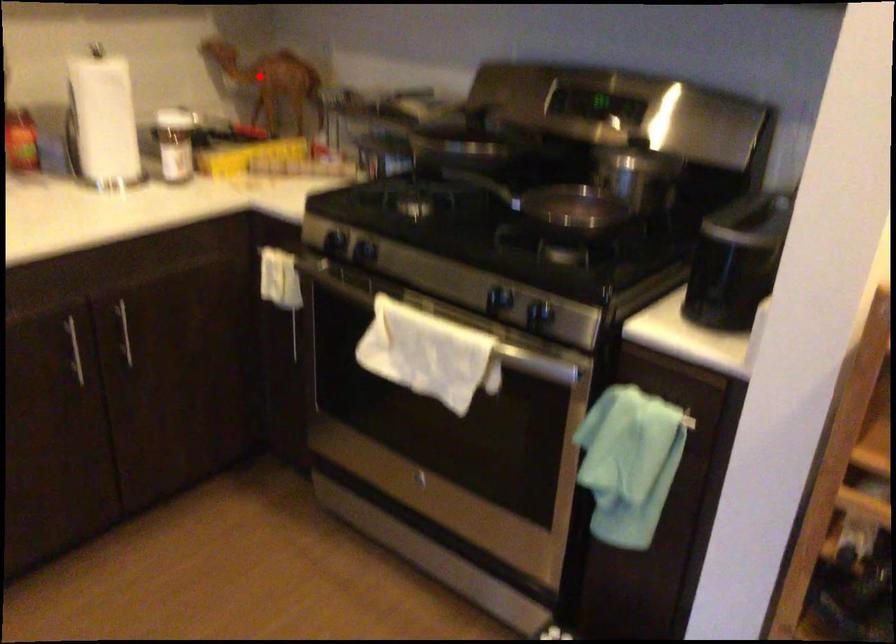
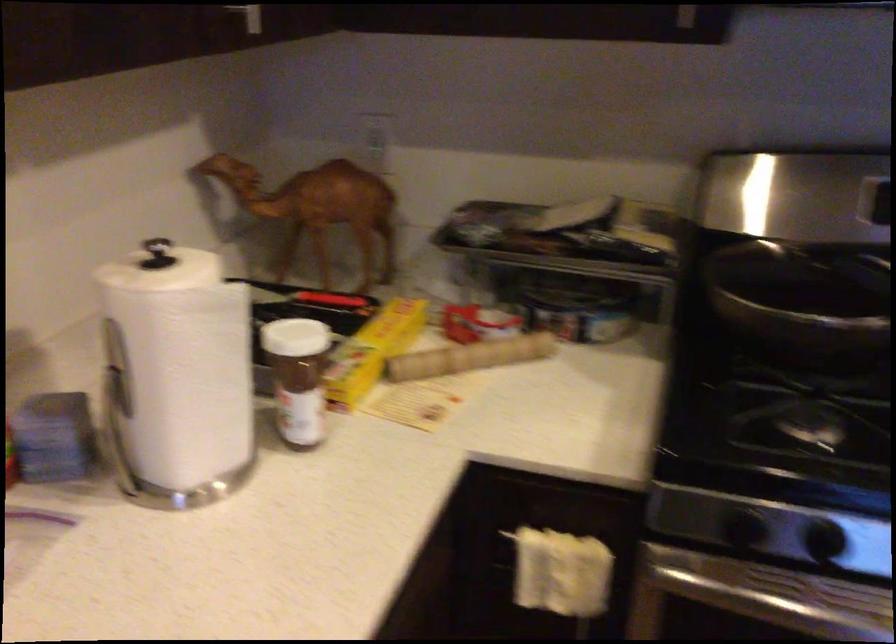
Question: I am providing you with two images of the same scene from different viewpoints. In image1, a red point is highlighted. Considering the same 3D point in image2, which of the following is correct?

Choices:
 (A) It is closer
 (B) It is farther

Answer: (A)